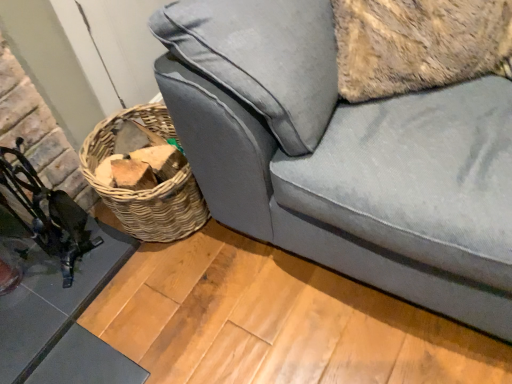
This screenshot has height=384, width=512. Describe the element at coordinates (48, 213) in the screenshot. I see `metallic black swivel chair at left` at that location.

Measure the distance between metallic black swivel chair at left and camera.

metallic black swivel chair at left and camera are 3.84 feet apart.

Measure the distance between velvet gray couch at lower right and camera.

The distance of velvet gray couch at lower right from camera is 31.43 inches.

The image size is (512, 384). Find the location of `woven brown basket at lower left`. woven brown basket at lower left is located at coordinates (149, 189).

Is velvet gray couch at lower right touching woven brown basket at lower left?

No, velvet gray couch at lower right is not in contact with woven brown basket at lower left.

From a real-world perspective, is velvet gray couch at lower right on woven brown basket at lower left?

Yes, from a real-world perspective, velvet gray couch at lower right is over woven brown basket at lower left

Is velvet gray couch at lower right outside of woven brown basket at lower left?

Absolutely, velvet gray couch at lower right is external to woven brown basket at lower left.

In the scene shown: Could you tell me if velvet gray couch at lower right is facing woven brown basket at lower left?

No, velvet gray couch at lower right is not turned towards woven brown basket at lower left.

The image size is (512, 384). Find the location of `studio couch that appears on the right of metallic black swivel chair at left`. studio couch that appears on the right of metallic black swivel chair at left is located at coordinates (343, 156).

Between point (174, 46) and point (57, 209), which one is positioned in front?

The point (174, 46) is closer.

Between velvet gray couch at lower right and metallic black swivel chair at left, which one has less height?

metallic black swivel chair at left is shorter.

Looking at this image, considering the relative sizes of velvet gray couch at lower right and metallic black swivel chair at left in the image provided, is velvet gray couch at lower right wider than metallic black swivel chair at left?

Correct, the width of velvet gray couch at lower right exceeds that of metallic black swivel chair at left.

Which is farther from the camera, (49, 315) or (39, 238)?

The point (39, 238) is farther.

How different are the orientations of glassy black table at lower left and metallic black swivel chair at left in degrees?

2.53 degrees separate the facing orientations of glassy black table at lower left and metallic black swivel chair at left.

Considering the relative sizes of glassy black table at lower left and metallic black swivel chair at left in the image provided, is glassy black table at lower left smaller than metallic black swivel chair at left?

Indeed, glassy black table at lower left has a smaller size compared to metallic black swivel chair at left.

Does glassy black table at lower left have a greater width compared to metallic black swivel chair at left?

Indeed, glassy black table at lower left has a greater width compared to metallic black swivel chair at left.

Identify the location of studio couch on the right of metallic black swivel chair at left. This screenshot has width=512, height=384. (343, 156).

Is metallic black swivel chair at left looking in the opposite direction of velvet gray couch at lower right?

metallic black swivel chair at left does not have its back to velvet gray couch at lower right.

How different are the orientations of metallic black swivel chair at left and velvet gray couch at lower right in degrees?

The facing directions of metallic black swivel chair at left and velvet gray couch at lower right are 90.5 degrees apart.

How many degrees apart are the facing directions of woven brown basket at lower left and metallic black swivel chair at left?

The angular difference between woven brown basket at lower left and metallic black swivel chair at left is 90 degrees.

From the image's perspective, is woven brown basket at lower left below metallic black swivel chair at left?

No.

Between woven brown basket at lower left and metallic black swivel chair at left, which one appears on the left side from the viewer's perspective?

From the viewer's perspective, metallic black swivel chair at left appears more on the left side.

Who is bigger, woven brown basket at lower left or metallic black swivel chair at left?

With larger size is woven brown basket at lower left.

From a real-world perspective, is woven brown basket at lower left over velvet gray couch at lower right?

No, from a real-world perspective, woven brown basket at lower left is not above velvet gray couch at lower right.

Does woven brown basket at lower left turn towards velvet gray couch at lower right?

No, woven brown basket at lower left is not turned towards velvet gray couch at lower right.

From the image's perspective, which one is positioned lower, woven brown basket at lower left or velvet gray couch at lower right?

woven brown basket at lower left.

Between woven brown basket at lower left and velvet gray couch at lower right, which one has smaller width?

With smaller width is woven brown basket at lower left.

Considering the relative sizes of woven brown basket at lower left and glassy black table at lower left in the image provided, is woven brown basket at lower left shorter than glassy black table at lower left?

No.

Which is more distant, (x=187, y=181) or (x=17, y=375)?

The point (x=187, y=181) is farther from the camera.

Locate an element on the screen. This screenshot has height=384, width=512. table that is below the woven brown basket at lower left (from the image's perspective) is located at coordinates (63, 319).

Is woven brown basket at lower left smaller than glassy black table at lower left?

No.

At what (x,y) coordinates should I click in order to perform the action: click on basket below the velvet gray couch at lower right (from a real-world perspective). Please return your answer as a coordinate pair (x, y). Looking at the image, I should click on (149, 189).

The image size is (512, 384). What are the coordinates of `studio couch lying on the right of metallic black swivel chair at left` in the screenshot? It's located at (343, 156).

Estimate the real-world distances between objects in this image. Which object is further from woven brown basket at lower left, glassy black table at lower left or metallic black swivel chair at left?

Based on the image, glassy black table at lower left appears to be further to woven brown basket at lower left.

When comparing their distances from woven brown basket at lower left, does velvet gray couch at lower right or metallic black swivel chair at left seem closer?

The object closer to woven brown basket at lower left is metallic black swivel chair at left.

From the image, which object appears to be farther from woven brown basket at lower left, velvet gray couch at lower right or glassy black table at lower left?

The object further to woven brown basket at lower left is velvet gray couch at lower right.

When comparing their distances from velvet gray couch at lower right, does metallic black swivel chair at left or glassy black table at lower left seem further?

Among the two, metallic black swivel chair at left is located further to velvet gray couch at lower right.

Looking at the image, which one is located further to velvet gray couch at lower right, glassy black table at lower left or metallic black swivel chair at left?

Based on the image, metallic black swivel chair at left appears to be further to velvet gray couch at lower right.

Looking at the image, which one is located further to glassy black table at lower left, woven brown basket at lower left or metallic black swivel chair at left?

woven brown basket at lower left is further to glassy black table at lower left.

Which object lies nearer to the anchor point glassy black table at lower left, metallic black swivel chair at left or velvet gray couch at lower right?

Among the two, metallic black swivel chair at left is located nearer to glassy black table at lower left.

Looking at this image, which object lies nearer to the anchor point velvet gray couch at lower right, woven brown basket at lower left or glassy black table at lower left?

woven brown basket at lower left lies closer to velvet gray couch at lower right than the other object.

Where is `basket between metallic black swivel chair at left and velvet gray couch at lower right in the horizontal direction`? basket between metallic black swivel chair at left and velvet gray couch at lower right in the horizontal direction is located at coordinates (149, 189).

Identify the location of basket between glassy black table at lower left and velvet gray couch at lower right. (149, 189).

Image resolution: width=512 pixels, height=384 pixels. I want to click on swivel chair situated between glassy black table at lower left and woven brown basket at lower left from left to right, so click(48, 213).

Find the location of `swivel chair located between glassy black table at lower left and velvet gray couch at lower right in the left-right direction`. swivel chair located between glassy black table at lower left and velvet gray couch at lower right in the left-right direction is located at coordinates (48, 213).